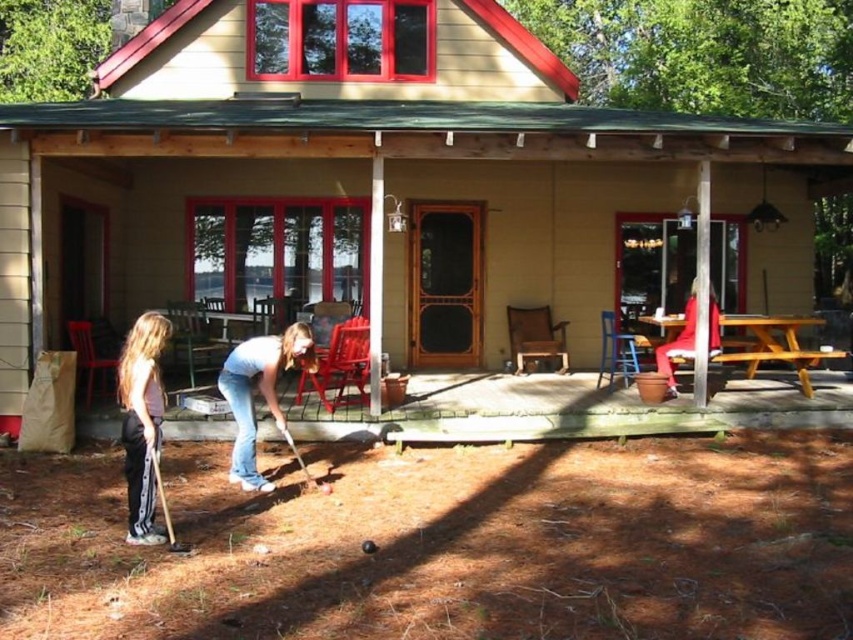
You are planning to set up a small buffet for a family gathering. You have a wooden picnic table at center and a blue jeans at center. Which surface can accommodate more dishes due to its larger size?

The blue jeans at center has a greater width than the wooden picnic table at center, so it can accommodate more dishes.

You are standing on the porch of the beige stucco cabin at center and want to wave to the person wearing the light pink cotton shirt at left. Which direction should you face to ensure they can see your hand gesture?

The beige stucco cabin at center is much taller than the light pink cotton shirt at left, so you should face towards the left side of the cabin to ensure the person wearing the light pink cotton shirt at left can see your hand gesture.